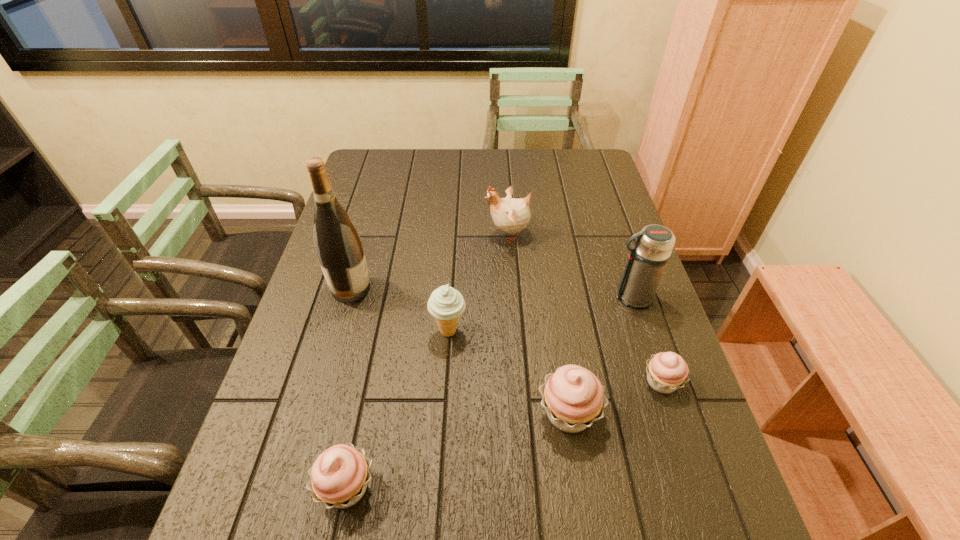
Locate an element on the screen. Image resolution: width=960 pixels, height=540 pixels. location for an additional cupcake to make spacing equal is located at coordinates (465, 448).